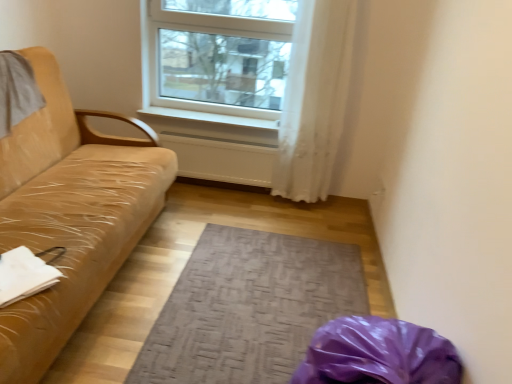
Question: Considering the positions of textured gray mat at center and white plastic window at upper center in the image, is textured gray mat at center bigger or smaller than white plastic window at upper center?

Choices:
 (A) small
 (B) big

Answer: (A)

Question: In the image, is textured gray mat at center positioned in front of or behind white plastic window at upper center?

Choices:
 (A) front
 (B) behind

Answer: (A)

Question: Which is nearer to the white sheer curtain at upper center?

Choices:
 (A) white plastic window at upper center
 (B) white smooth window sill at center
 (C) textured gray mat at center
 (D) tan leather couch at left

Answer: (A)

Question: Based on their relative distances, which object is farther from the white sheer curtain at upper center?

Choices:
 (A) white smooth window sill at center
 (B) tan leather couch at left
 (C) textured gray mat at center
 (D) white plastic window at upper center

Answer: (B)